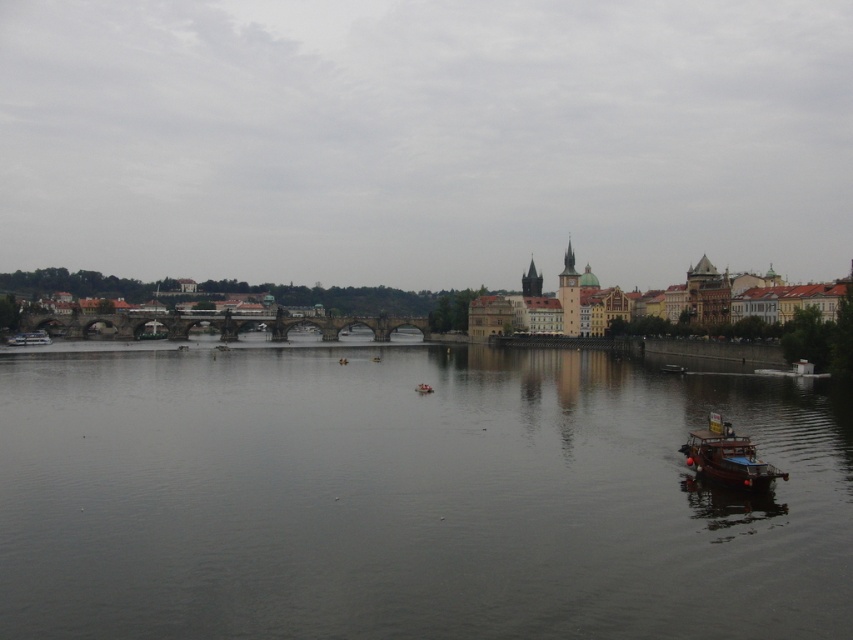
Who is positioned more to the left, dark gray water at center or wooden boat at left?

From the viewer's perspective, wooden boat at left appears more on the left side.

Can you confirm if dark gray water at center is taller than wooden boat at left?

Yes.

Does point (192, 483) lie behind point (28, 336)?

That is False.

Identify the location of dark gray water at center. (410, 497).

Based on the photo, can you confirm if wooden boat at lower right is positioned to the right of wooden boat at left?

Indeed, wooden boat at lower right is positioned on the right side of wooden boat at left.

Is wooden boat at lower right below wooden boat at left?

Correct, wooden boat at lower right is located below wooden boat at left.

You are a GUI agent. You are given a task and a screenshot of the screen. Output one action in this format:
    pyautogui.click(x=<x>, y=<y>)
    Task: Click on the wooden boat at lower right
    The height and width of the screenshot is (640, 853).
    Given the screenshot: What is the action you would take?
    click(727, 456)

Is dark gray water at center behind wooden boat at lower right?

That is False.

Does point (836, 576) lie behind point (711, 477)?

No, (836, 576) is closer to viewer.

Who is more distant from viewer, (x=335, y=516) or (x=740, y=456)?

The point (x=740, y=456) is behind.

The image size is (853, 640). Identify the location of dark gray water at center. (410, 497).